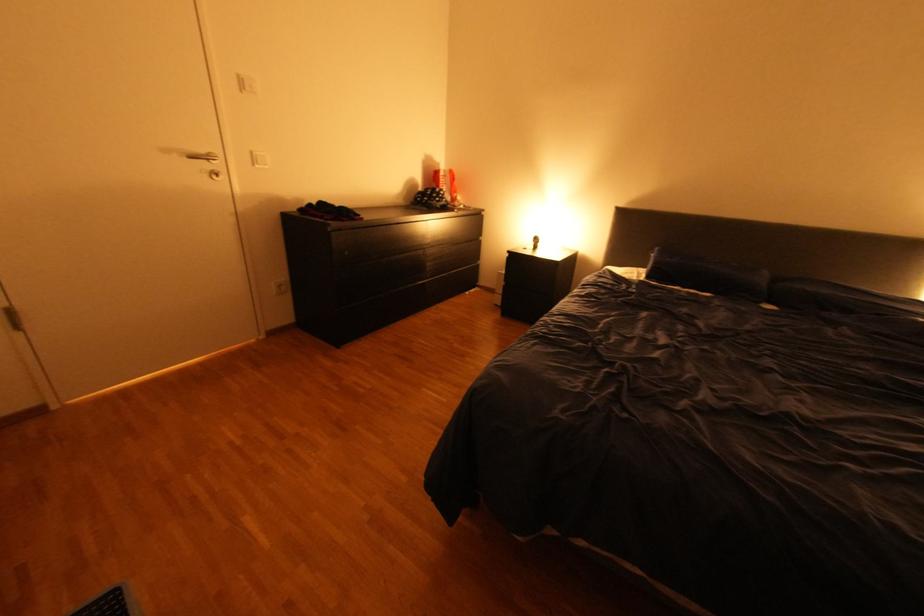
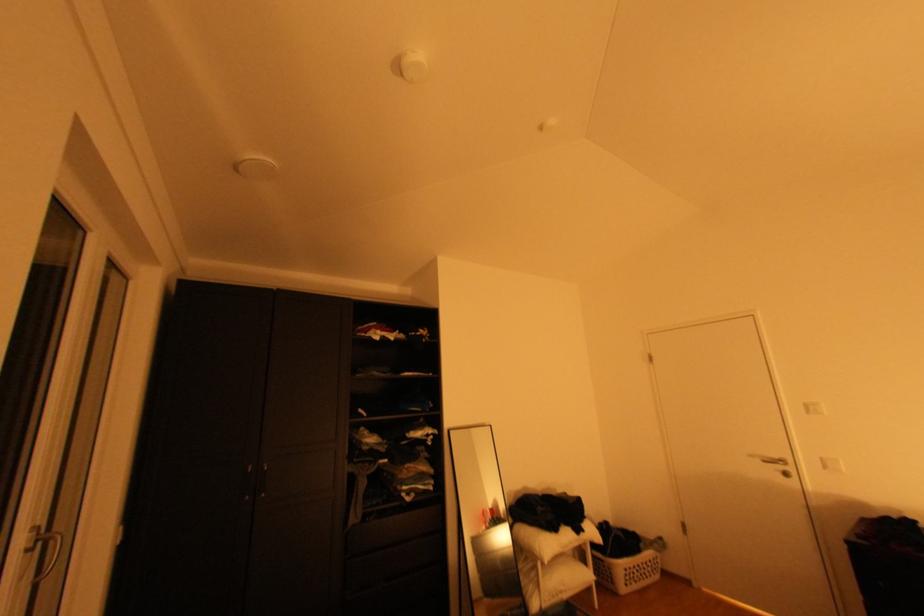
In the second image, find the point that corresponds to (213,151) in the first image.

(786, 456)